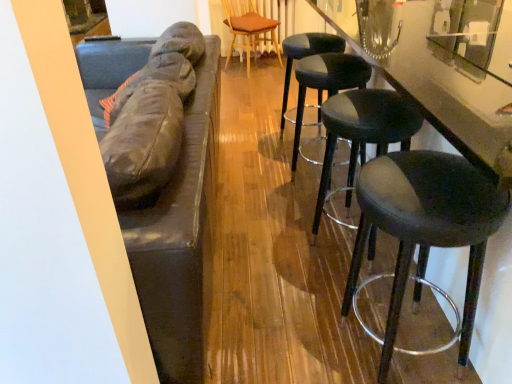
Identify the location of vacant space underneath wooden textured chair at center (from a real-world perspective). The image size is (512, 384). (246, 74).